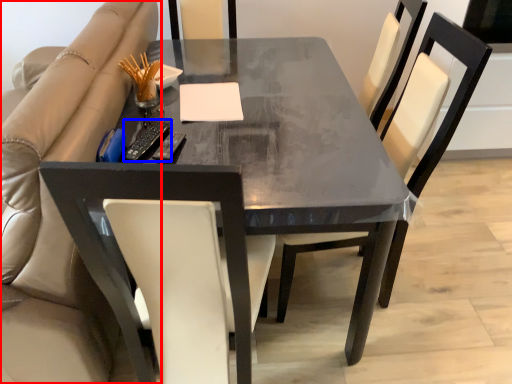
Question: Among these objects, which one is nearest to the camera, beige (highlighted by a red box) or remote (highlighted by a blue box)?

Choices:
 (A) beige
 (B) remote

Answer: (A)